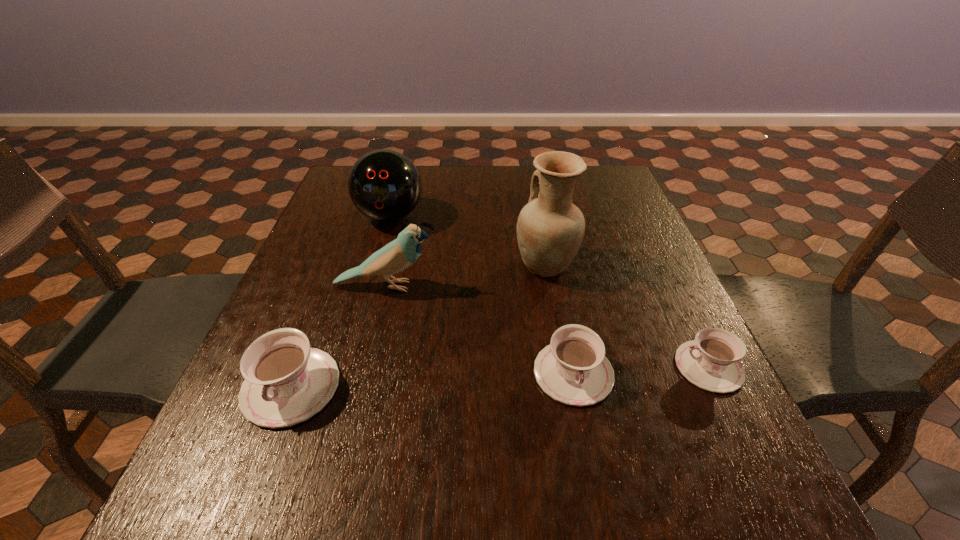
This screenshot has height=540, width=960. I want to click on the leftmost teacup, so coord(286,382).

At what (x,y) coordinates should I click in order to perform the action: click on the second shortest teacup. Please return your answer as a coordinate pair (x, y). This screenshot has height=540, width=960. Looking at the image, I should click on (573, 369).

Locate an element on the screen. the fifth tallest object is located at coordinates (573, 369).

At what (x,y) coordinates should I click in order to perform the action: click on the rightmost object. Please return your answer as a coordinate pair (x, y). Looking at the image, I should click on (711, 361).

This screenshot has width=960, height=540. What are the coordinates of `the shortest object` in the screenshot? It's located at (711, 361).

The height and width of the screenshot is (540, 960). I want to click on the tallest object, so click(x=550, y=228).

Where is `bowling ball`? bowling ball is located at coordinates [384, 185].

Locate an element on the screen. bird is located at coordinates (396, 256).

Where is `vacant space located 0.220m on the handle side of the shortest object`? The height and width of the screenshot is (540, 960). vacant space located 0.220m on the handle side of the shortest object is located at coordinates (562, 367).

The image size is (960, 540). What are the coordinates of `vacant point located on the handle side of the shortest object` in the screenshot? It's located at (613, 367).